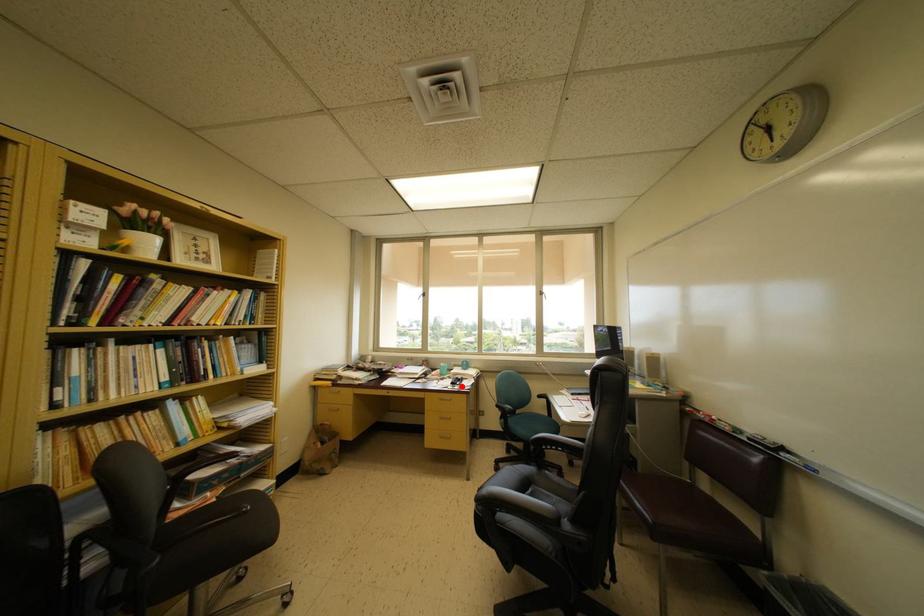
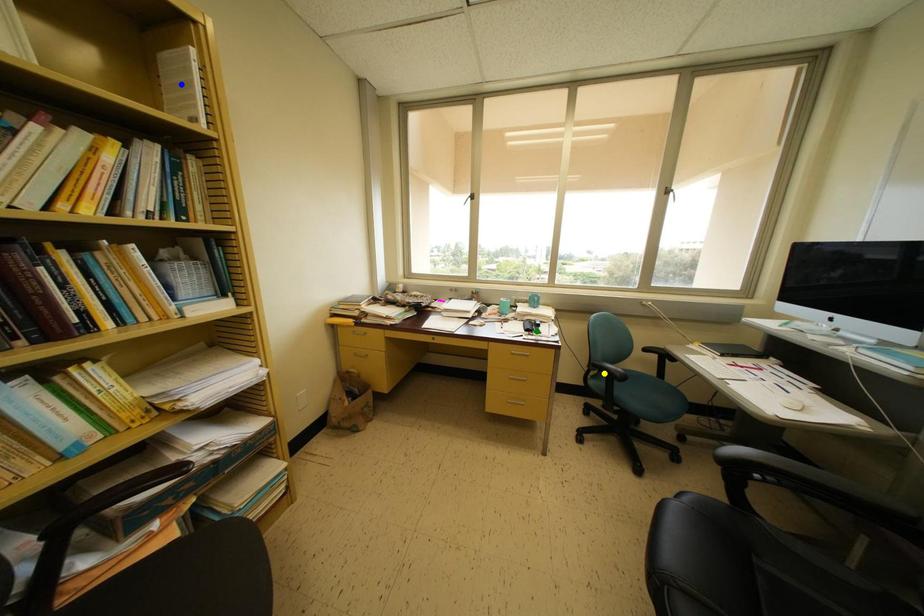
Question: I am providing you with two images of the same scene from different viewpoints. A red point is marked on the first image. You are given multiple points on the second image. Which mark in image 2 goes with the point in image 1?

Choices:
 (A) blue point
 (B) yellow point
 (C) green point

Answer: (C)